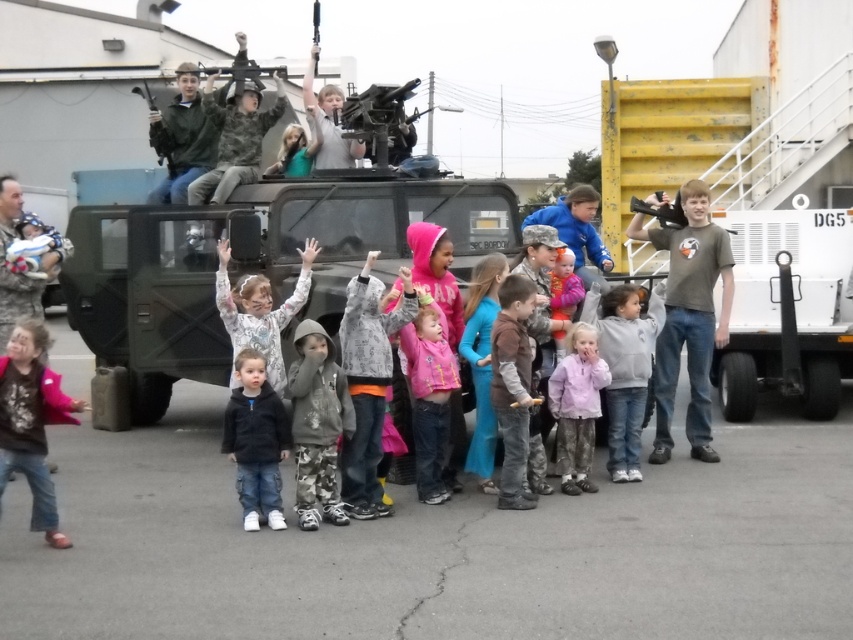
Between pink fleece jacket at center and camouflage uniform at left, which one has more height?

camouflage uniform at left

Which is above, pink fleece jacket at center or camouflage uniform at left?

Positioned higher is camouflage uniform at left.

This screenshot has height=640, width=853. In order to click on pink fleece jacket at center in this screenshot , I will do `click(428, 400)`.

What are the coordinates of `pink fleece jacket at center` in the screenshot? It's located at 428,400.

Who is positioned more to the left, brown matte shirt at lower left or pink matte jacket at center?

brown matte shirt at lower left

Can you confirm if brown matte shirt at lower left is taller than pink matte jacket at center?

Indeed, brown matte shirt at lower left has a greater height compared to pink matte jacket at center.

Locate an element on the screen. brown matte shirt at lower left is located at coordinates (32, 420).

Locate an element on the screen. The image size is (853, 640). brown matte shirt at lower left is located at coordinates (32, 420).

Is gray fleece jacket at center to the right of pink matte jacket at center from the viewer's perspective?

Indeed, gray fleece jacket at center is positioned on the right side of pink matte jacket at center.

Does point (621, 333) come in front of point (567, 381)?

No, (621, 333) is further to viewer.

At what (x,y) coordinates should I click in order to perform the action: click on gray fleece jacket at center. Please return your answer as a coordinate pair (x, y). The image size is (853, 640). Looking at the image, I should click on (624, 376).